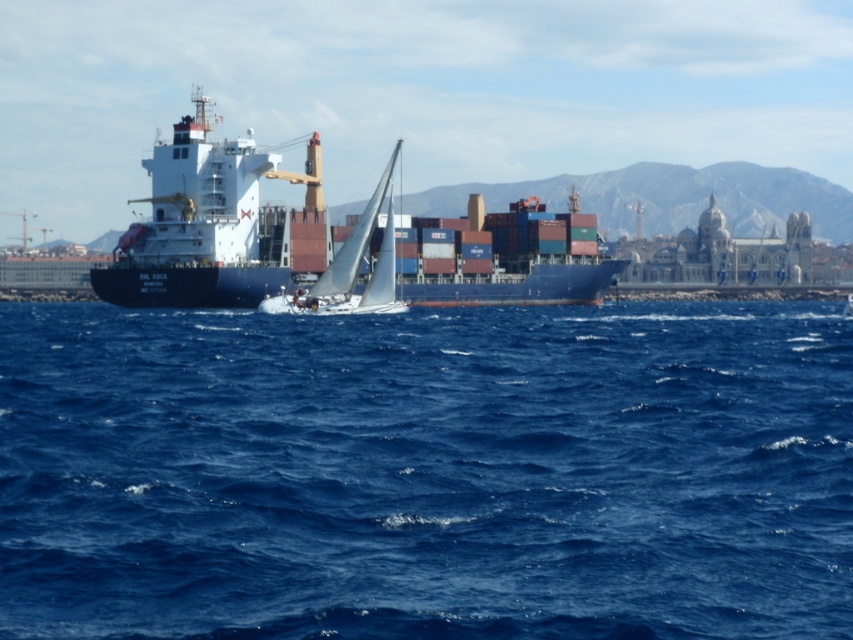
Question: Can you confirm if blue water at center is bigger than blue matte cargo ship at center?

Choices:
 (A) no
 (B) yes

Answer: (B)

Question: Does blue water at center have a lesser width compared to blue matte cargo ship at center?

Choices:
 (A) yes
 (B) no

Answer: (B)

Question: Which point is farther to the camera?

Choices:
 (A) blue water at center
 (B) white sailboat at center

Answer: (B)

Question: Which of these objects is positioned closest to the blue water at center?

Choices:
 (A) white sailboat at center
 (B) blue matte cargo ship at center

Answer: (B)

Question: Does blue water at center have a larger size compared to white sailboat at center?

Choices:
 (A) no
 (B) yes

Answer: (B)

Question: Which object is closer to the camera taking this photo?

Choices:
 (A) blue matte cargo ship at center
 (B) blue water at center

Answer: (B)